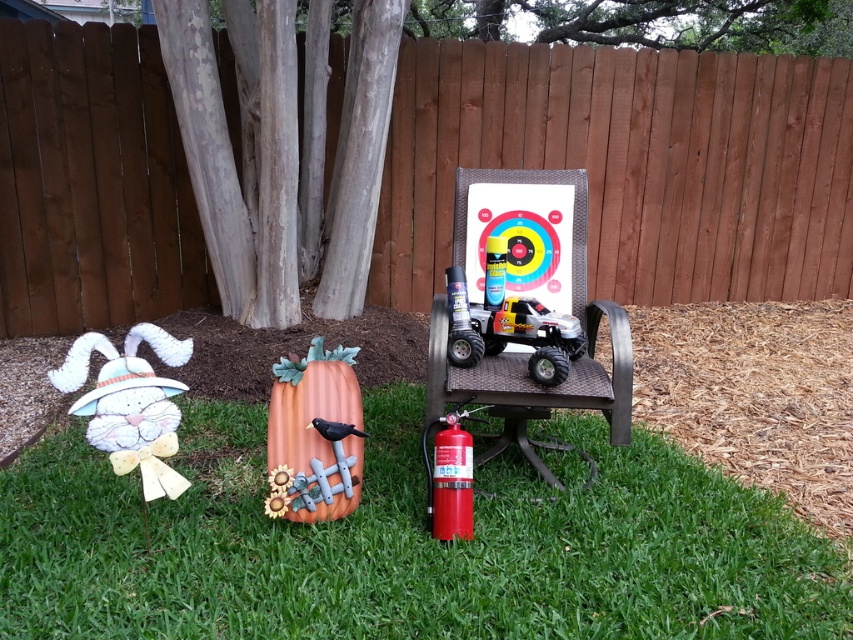
Question: Can you confirm if metallic plastic wagon at center is positioned to the left of red matte fire extinguisher at center?

Choices:
 (A) no
 (B) yes

Answer: (A)

Question: Which object is positioned farthest from the white fabric bunny at left?

Choices:
 (A) red matte fire extinguisher at center
 (B) brown wood fence at upper center
 (C) metallic plastic wagon at center

Answer: (B)

Question: Can you confirm if orange matte pumpkin at lower left is smaller than red matte fire extinguisher at center?

Choices:
 (A) no
 (B) yes

Answer: (A)

Question: Considering the real-world distances, which object is closest to the white fabric bunny at left?

Choices:
 (A) orange matte pumpkin at lower left
 (B) green grass at lower left
 (C) red matte fire extinguisher at center

Answer: (A)

Question: Which point is farther from the camera taking this photo?

Choices:
 (A) (91, 340)
 (B) (335, 512)

Answer: (B)

Question: Can you confirm if green grass at lower left is smaller than red matte fire extinguisher at center?

Choices:
 (A) yes
 (B) no

Answer: (B)